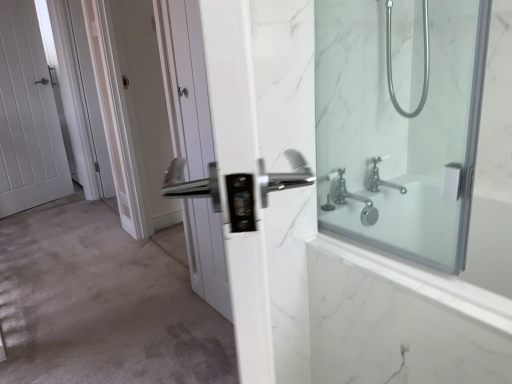
Question: Is white matte door at center to the left of white wooden door at left, placed as the first door when sorted from back to front, from the viewer's perspective?

Choices:
 (A) no
 (B) yes

Answer: (A)

Question: Can you confirm if white matte door at center is bigger than white wooden door at left, the first door viewed from the left?

Choices:
 (A) yes
 (B) no

Answer: (B)

Question: Is white matte door at center surrounding white wooden door at left, the 2th door in the right-to-left sequence?

Choices:
 (A) no
 (B) yes

Answer: (A)

Question: Can you confirm if white matte door at center is taller than white wooden door at left, the first door viewed from the left?

Choices:
 (A) no
 (B) yes

Answer: (A)

Question: Does white matte door at center come behind white wooden door at left, the 2th door in the right-to-left sequence?

Choices:
 (A) yes
 (B) no

Answer: (B)

Question: Does white matte door at center have a lesser width compared to white wooden door at left, the 2th door in the right-to-left sequence?

Choices:
 (A) no
 (B) yes

Answer: (A)

Question: From the image's perspective, is white matte door at center located beneath white glossy door at upper left, the 1th screen door positioned from the back?

Choices:
 (A) no
 (B) yes

Answer: (B)

Question: Is white matte door at center completely or partially outside of white glossy door at upper left, the 1th screen door positioned from the back?

Choices:
 (A) no
 (B) yes

Answer: (B)

Question: Is white matte door at center aimed at white glossy door at upper left, which is the 2th screen door in right-to-left order?

Choices:
 (A) yes
 (B) no

Answer: (B)

Question: Is white matte door at center next to white glossy door at upper left, which is the 2th screen door in right-to-left order?

Choices:
 (A) yes
 (B) no

Answer: (B)

Question: Is white glossy door at upper left, the 1th screen door positioned from the back, at the back of white matte door at center?

Choices:
 (A) yes
 (B) no

Answer: (B)

Question: Would you consider white matte door at center to be distant from white glossy door at upper left, which is the 2th screen door in right-to-left order?

Choices:
 (A) no
 (B) yes

Answer: (B)

Question: Does satin nickel handle at center, acting as the 2th screen door starting from the back, appear on the right side of white glossy door handle at center, the 1th door when ordered from front to back?

Choices:
 (A) yes
 (B) no

Answer: (B)